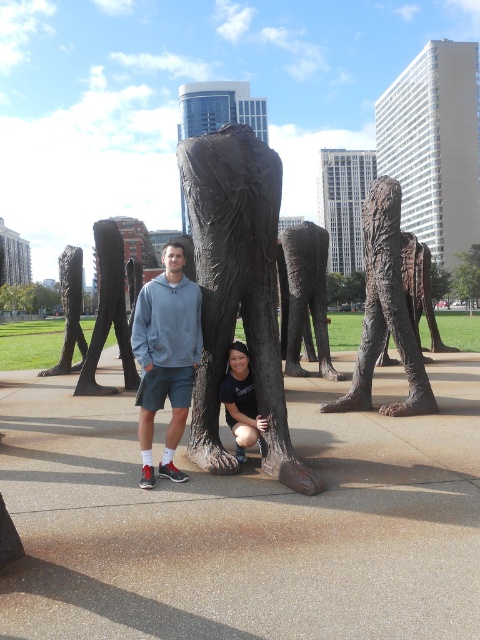
Question: Does matte black shirt at center appear on the right side of bronze statue leg at center?

Choices:
 (A) yes
 (B) no

Answer: (A)

Question: Is bronze/sculpture at center bigger than matte black shirt at center?

Choices:
 (A) no
 (B) yes

Answer: (B)

Question: Can you confirm if bronze textured sculpture at center is positioned above bronze statue leg at center?

Choices:
 (A) no
 (B) yes

Answer: (B)

Question: Which point appears farthest from the camera in this image?

Choices:
 (A) 240,154
 (B) 72,326
 (C) 284,324

Answer: (B)

Question: Which object is positioned farthest from the matte gray hoodie at center?

Choices:
 (A) bronze statue leg at center
 (B) matte black shirt at center

Answer: (A)

Question: Considering the real-world distances, which object is farthest from the bronze statue leg at center?

Choices:
 (A) rusty metal elephant at center
 (B) bronze/sculpture at center
 (C) matte gray hoodie at center
 (D) bronze textured leg at center

Answer: (C)